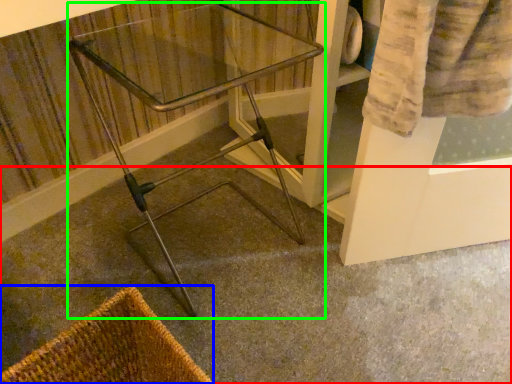
Question: Which object is positioned closest to concrete (highlighted by a red box)? Select from basket (highlighted by a blue box) and furniture (highlighted by a green box).

Choices:
 (A) basket
 (B) furniture

Answer: (B)